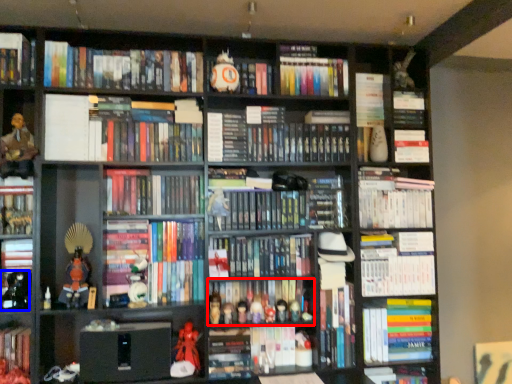
Question: Which point is closer to the camera, book (highlighted by a red box) or toy (highlighted by a blue box)?

Choices:
 (A) book
 (B) toy

Answer: (B)